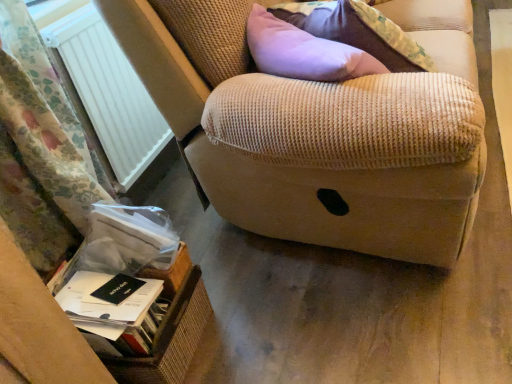
Question: Is floral fabric curtain at left in front of white plastic radiator at left?

Choices:
 (A) no
 (B) yes

Answer: (B)

Question: Is floral fabric curtain at left wider than white plastic radiator at left?

Choices:
 (A) no
 (B) yes

Answer: (B)

Question: Would you say floral fabric curtain at left is outside white plastic radiator at left?

Choices:
 (A) no
 (B) yes

Answer: (B)

Question: Would you consider floral fabric curtain at left to be distant from white plastic radiator at left?

Choices:
 (A) yes
 (B) no

Answer: (B)

Question: Is floral fabric curtain at left oriented towards white plastic radiator at left?

Choices:
 (A) yes
 (B) no

Answer: (B)

Question: From a real-world perspective, relative to black matte paperback book at lower left, the 1th paperback book viewed from the top, is beige corduroy armrest at upper right vertically above or below?

Choices:
 (A) below
 (B) above

Answer: (B)

Question: From the image's perspective, relative to black matte paperback book at lower left, the 1th paperback book viewed from the top, is beige corduroy armrest at upper right above or below?

Choices:
 (A) below
 (B) above

Answer: (B)

Question: In terms of height, does beige corduroy armrest at upper right look taller or shorter compared to black matte paperback book at lower left, the 1th paperback book viewed from the top?

Choices:
 (A) tall
 (B) short

Answer: (A)

Question: Looking at the image, does beige corduroy armrest at upper right seem bigger or smaller compared to black matte paperback book at lower left, the second paperback book positioned from the bottom?

Choices:
 (A) big
 (B) small

Answer: (A)

Question: Considering the positions of brown wicker basket at lower left and black matte paperback book at lower left, the second paperback book positioned from the bottom, in the image, is brown wicker basket at lower left taller or shorter than black matte paperback book at lower left, the second paperback book positioned from the bottom,?

Choices:
 (A) short
 (B) tall

Answer: (B)

Question: From the image's perspective, relative to black matte paperback book at lower left, the second paperback book positioned from the bottom, is brown wicker basket at lower left above or below?

Choices:
 (A) below
 (B) above

Answer: (A)

Question: Is brown wicker basket at lower left to the left or to the right of black matte paperback book at lower left, the second paperback book positioned from the bottom, in the image?

Choices:
 (A) left
 (B) right

Answer: (B)

Question: Does point (190, 289) appear closer or farther from the camera than point (98, 296)?

Choices:
 (A) closer
 (B) farther

Answer: (B)

Question: Is white plastic radiator at left bigger or smaller than beige corduroy armrest at upper right?

Choices:
 (A) big
 (B) small

Answer: (B)

Question: From the image's perspective, relative to beige corduroy armrest at upper right, is white plastic radiator at left above or below?

Choices:
 (A) above
 (B) below

Answer: (A)